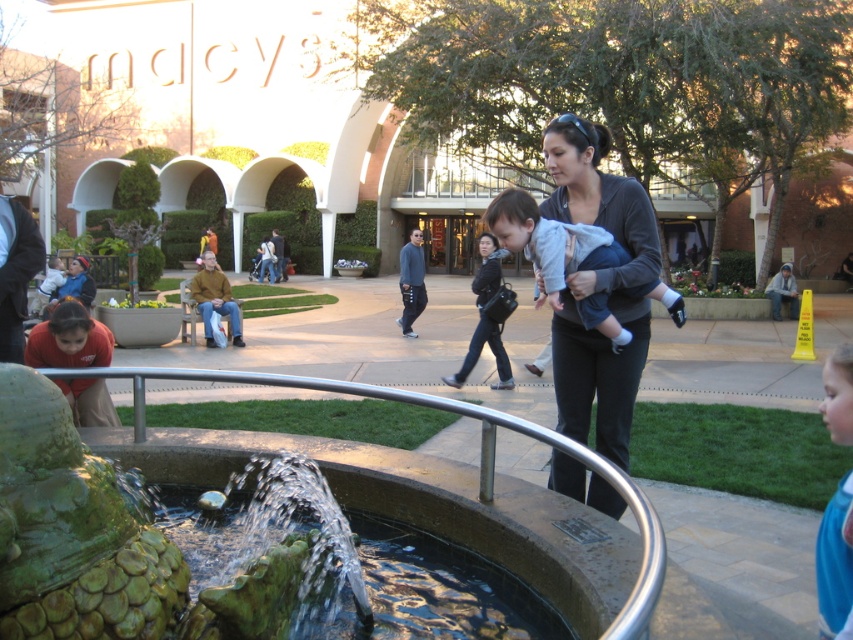
Who is lower down, dark gray sweater at center or matte black jacket at center?

dark gray sweater at center

Between point (567, 152) and point (491, 241), which one is positioned behind?

The point (491, 241) is behind.

Locate an element on the screen. The width and height of the screenshot is (853, 640). dark gray sweater at center is located at coordinates (598, 288).

What do you see at coordinates (550, 243) in the screenshot? Image resolution: width=853 pixels, height=640 pixels. I see `light gray fleece at center` at bounding box center [550, 243].

Consider the image. Who is more forward, [605,257] or [834,403]?

Point [834,403] is more forward.

Describe the element at coordinates (550, 243) in the screenshot. I see `light gray fleece at center` at that location.

This screenshot has width=853, height=640. I want to click on light gray fleece at center, so click(x=550, y=243).

Is matte stone fountain at center above dark gray sweater at center?

Indeed, matte stone fountain at center is positioned over dark gray sweater at center.

Is matte stone fountain at center bigger than dark gray sweater at center?

Yes, matte stone fountain at center is bigger than dark gray sweater at center.

Is point (553, 22) positioned behind point (645, 358)?

Yes, point (553, 22) is behind point (645, 358).

Identify the location of matte stone fountain at center. The width and height of the screenshot is (853, 640). (469, 106).